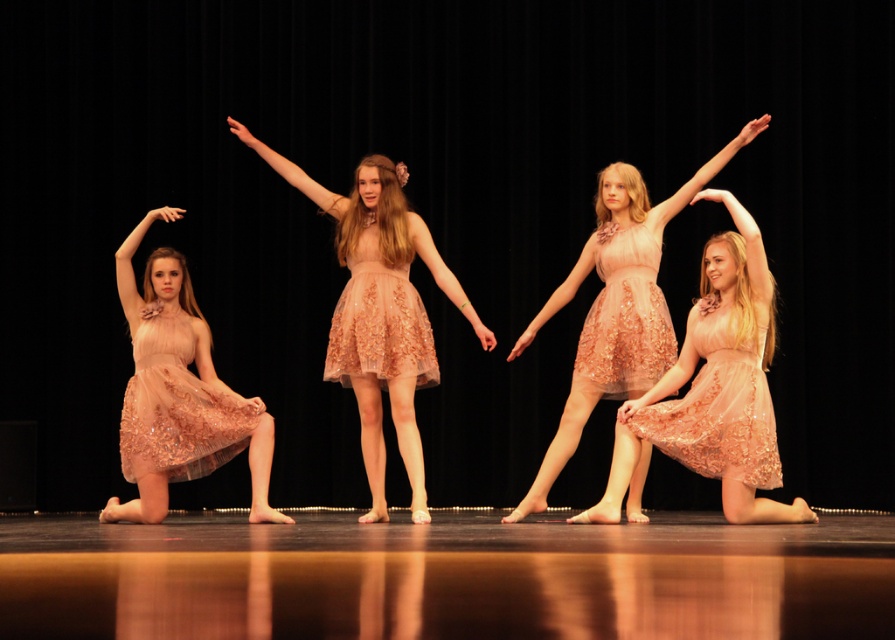
Can you confirm if matte peach tulle dress at left is smaller than lace dress at center?

Actually, matte peach tulle dress at left might be larger than lace dress at center.

Is point (271, 516) farther from camera compared to point (680, 397)?

That is True.

Identify the location of matte peach tulle dress at left. (188, 417).

Which of these two, matte peach tulle dress at left or matte tulle dress at center, stands shorter?

With less height is matte tulle dress at center.

Who is taller, matte peach tulle dress at left or matte tulle dress at center?

matte peach tulle dress at left

Which is behind, point (197, 460) or point (640, 243)?

The point (197, 460) is behind.

At what (x,y) coordinates should I click in order to perform the action: click on matte peach tulle dress at left. Please return your answer as a coordinate pair (x, y). The image size is (895, 640). Looking at the image, I should click on (188, 417).

Does matte tulle dress at center appear on the left side of lace peach dress at center?

No, matte tulle dress at center is not to the left of lace peach dress at center.

Which is in front, point (645, 321) or point (335, 362)?

Point (645, 321) is more forward.

Is point (635, 256) farther from viewer compared to point (361, 364)?

No, (635, 256) is in front of (361, 364).

Locate an element on the screen. This screenshot has height=640, width=895. matte tulle dress at center is located at coordinates (625, 316).